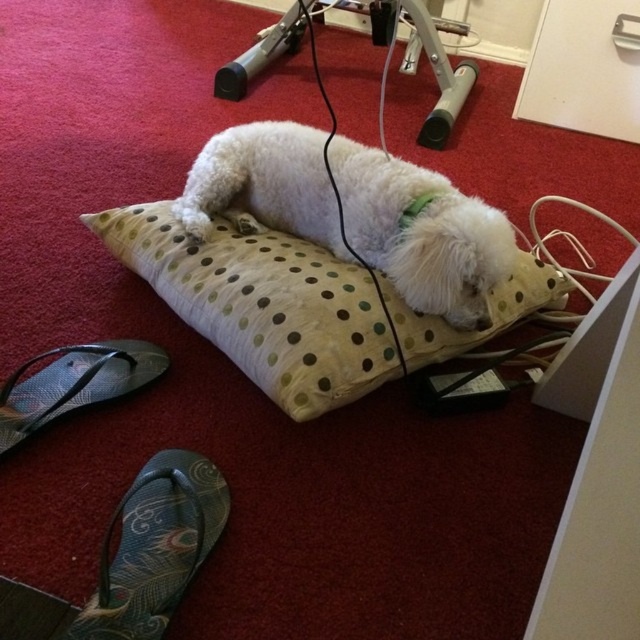
Is point (244, 225) more distant than point (193, 502)?

Yes, point (244, 225) is farther from viewer.

Is white fluffy dog at center taller than green fabric sandal at lower left?

Yes.

Find the location of a particular element. This screenshot has height=640, width=640. white fluffy dog at center is located at coordinates (420, 232).

Between beige dotted pillow at center and textured fabric sandal at lower left, which one has more height?

With more height is beige dotted pillow at center.

Who is more distant from viewer, (432, 349) or (109, 394)?

Point (432, 349)

Where is `beige dotted pillow at center`? beige dotted pillow at center is located at coordinates (262, 305).

Who is more forward, (173, 250) or (176, 460)?

→ Point (176, 460) is more forward.

Which of these two, beige dotted pillow at center or green fabric sandal at lower left, stands taller?

beige dotted pillow at center is taller.

In order to click on beige dotted pillow at center in this screenshot , I will do `click(262, 305)`.

This screenshot has height=640, width=640. I want to click on beige dotted pillow at center, so click(262, 305).